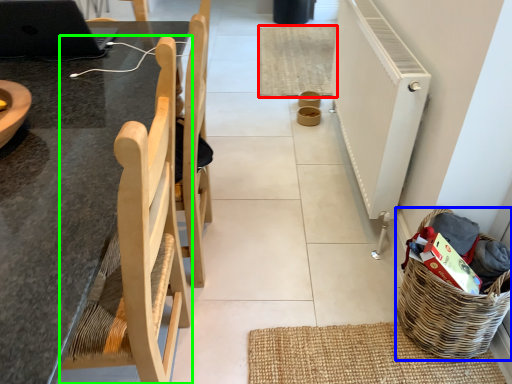
Question: Estimate the real-world distances between objects in this image. Which object is farther from mat (highlighted by a red box), basket (highlighted by a blue box) or chair (highlighted by a green box)?

Choices:
 (A) basket
 (B) chair

Answer: (B)